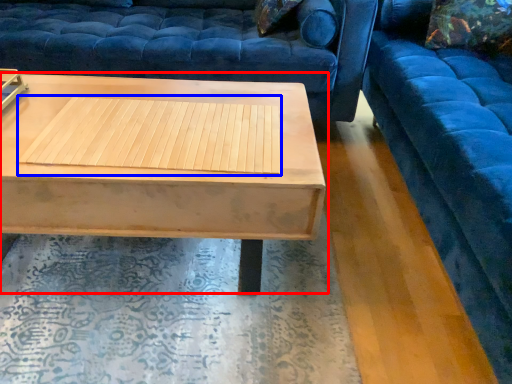
Question: Which point is further to the camera, coffee table (highlighted by a red box) or wood (highlighted by a blue box)?

Choices:
 (A) coffee table
 (B) wood

Answer: (B)